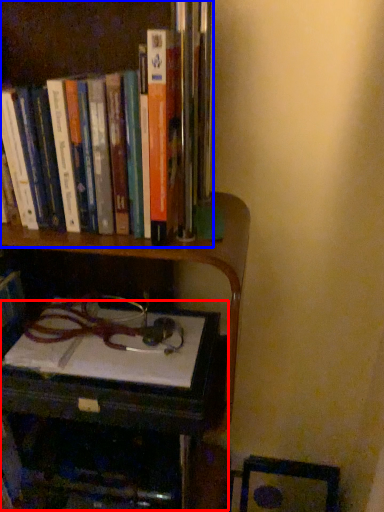
Question: Which object appears closest to the camera in this image, table (highlighted by a red box) or book (highlighted by a blue box)?

Choices:
 (A) table
 (B) book

Answer: (B)